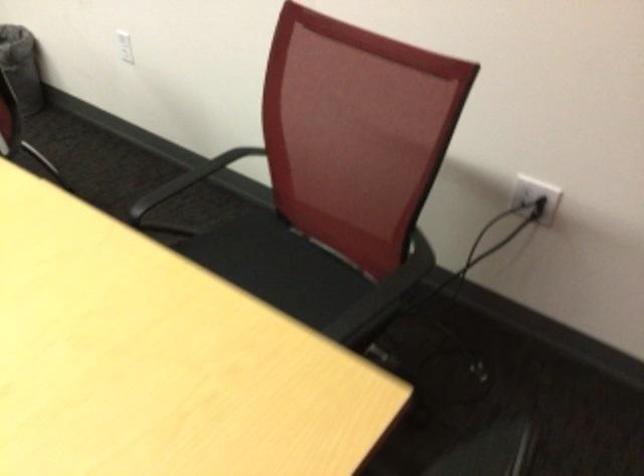
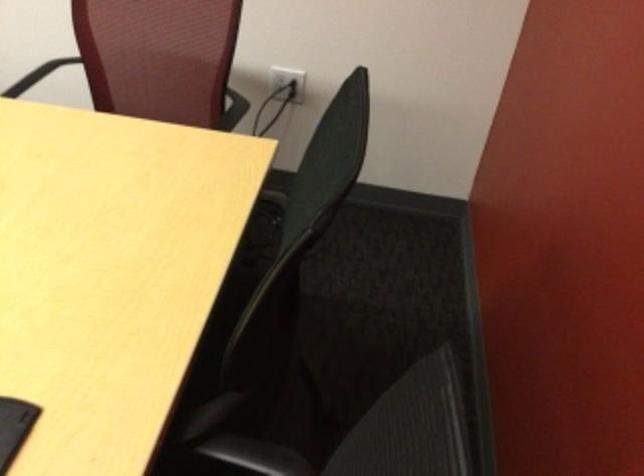
The point at (531, 197) is marked in the first image. Where is the corresponding point in the second image?

(288, 81)